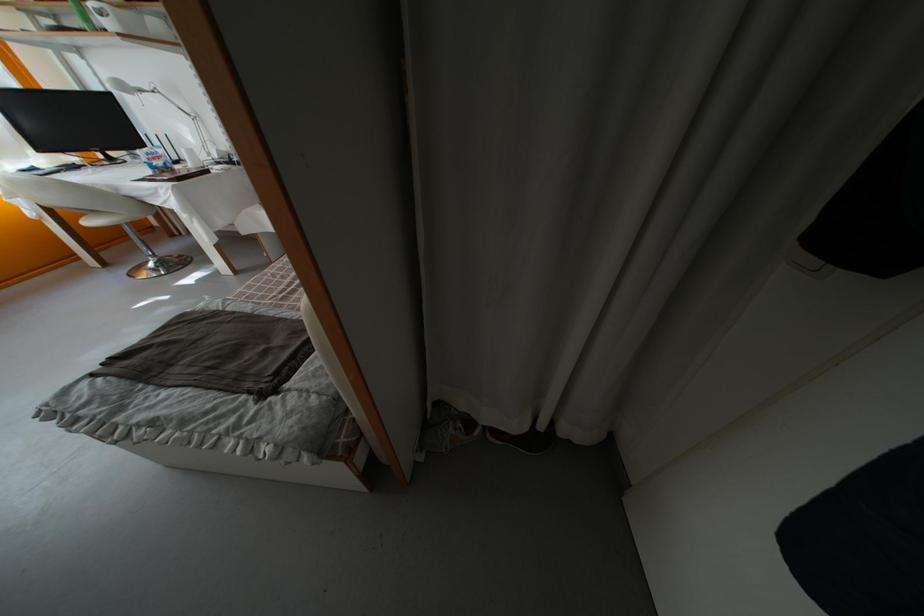
Where would you reposition the white desk lamp? Please return your answer as a coordinate pair (x, y).

(166, 111)